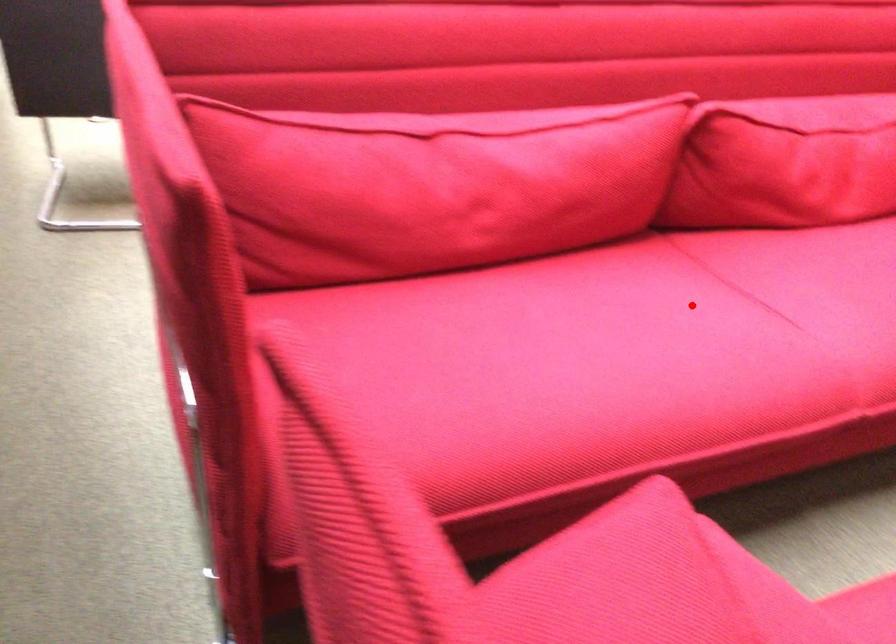
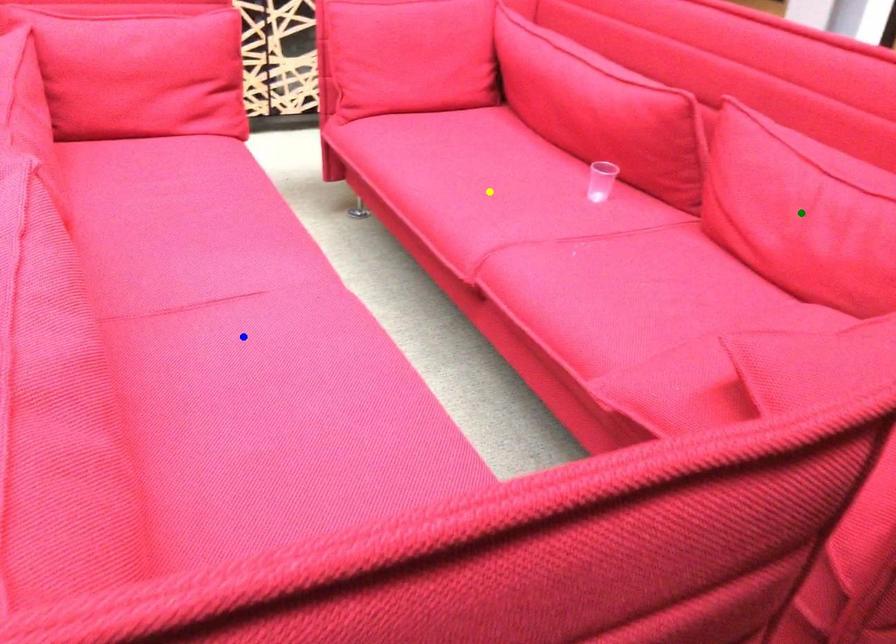
Question: I am providing you with two images of the same scene from different viewpoints. A red point is marked on the first image. You are given multiple points on the second image. Which point in image 2 is actually the same real-world point as the red point in image 1?

Choices:
 (A) yellow point
 (B) green point
 (C) blue point

Answer: (C)